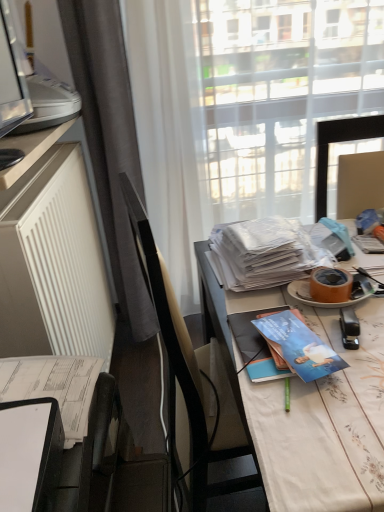
Locate an element on the screen. This screenshot has width=384, height=512. free space behind blue glossy book at center, the second magazine in the back-to-front sequence is located at coordinates (249, 298).